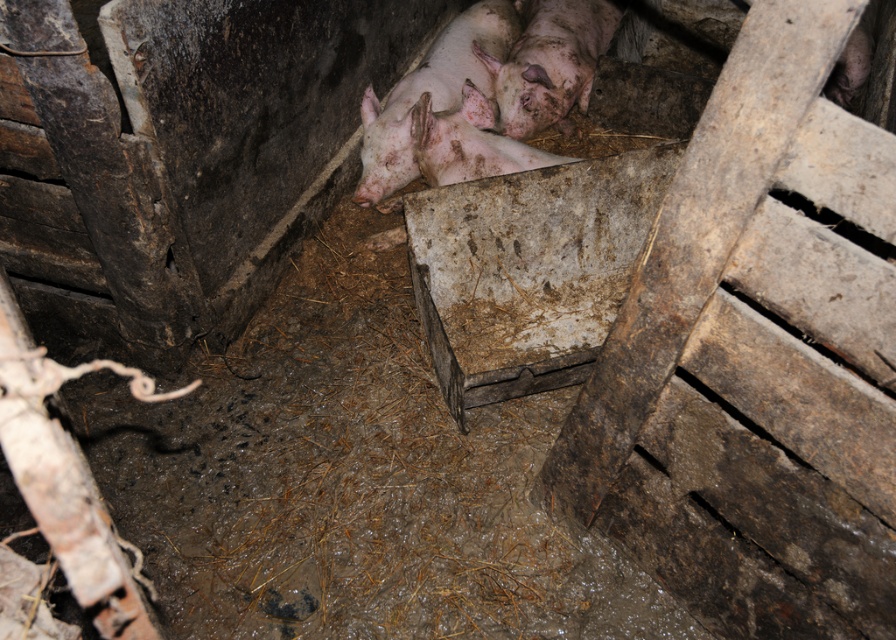
Question: Which of the following is the farthest from the observer?

Choices:
 (A) pinkish muddy pig at center
 (B) pinkish muddy pig at upper center

Answer: (B)

Question: Does pinkish muddy pig at center have a smaller size compared to pinkish muddy pig at upper center?

Choices:
 (A) no
 (B) yes

Answer: (A)

Question: Observing the image, what is the correct spatial positioning of pinkish muddy pig at center in reference to pinkish muddy pig at upper center?

Choices:
 (A) right
 (B) left

Answer: (B)

Question: Is pinkish muddy pig at center below pinkish muddy pig at upper center?

Choices:
 (A) yes
 (B) no

Answer: (A)

Question: Which object appears farthest from the camera in this image?

Choices:
 (A) pinkish muddy pig at upper center
 (B) pinkish muddy pig at center

Answer: (A)

Question: Which point appears farthest from the camera in this image?

Choices:
 (A) (383, 168)
 (B) (569, 3)

Answer: (B)